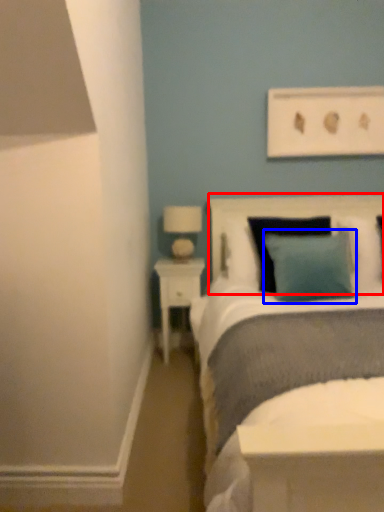
Question: Among these objects, which one is farthest to the camera, headboard (highlighted by a red box) or pillow (highlighted by a blue box)?

Choices:
 (A) headboard
 (B) pillow

Answer: (A)